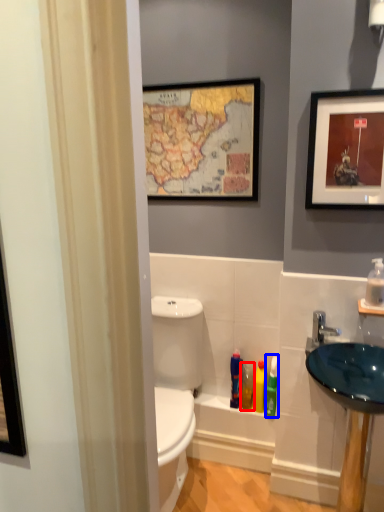
Question: Among these objects, which one is nearest to the camera, toiletry (highlighted by a red box) or toiletry (highlighted by a blue box)?

Choices:
 (A) toiletry
 (B) toiletry

Answer: (B)